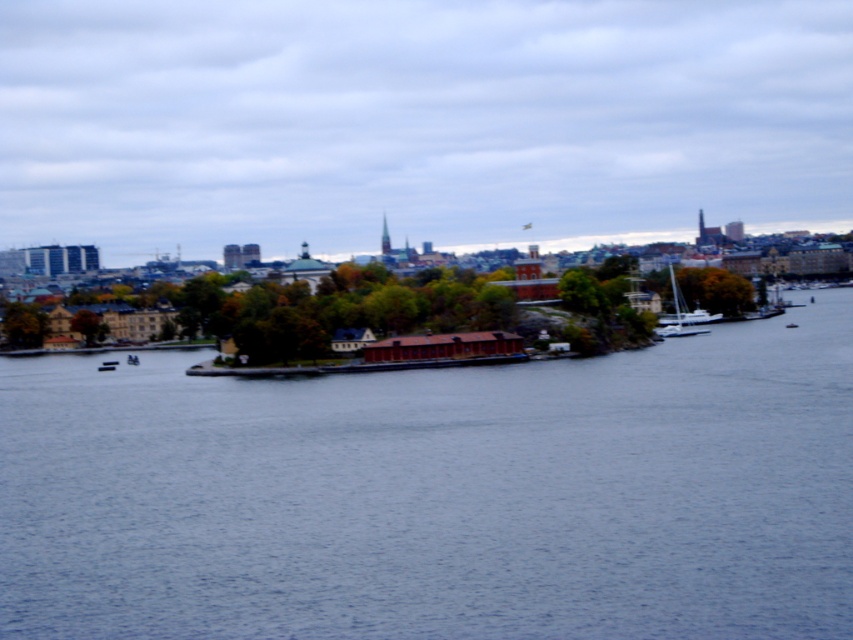
Question: Does blue water at center appear on the right side of green matte tree at center-left?

Choices:
 (A) yes
 (B) no

Answer: (A)

Question: Which object appears closest to the camera in this image?

Choices:
 (A) green matte tree at center-left
 (B) blue water at center
 (C) green matte tree at left

Answer: (B)

Question: Which point is closer to the camera?

Choices:
 (A) (96, 324)
 (B) (38, 346)
 (C) (672, 278)

Answer: (B)

Question: Which of the following is the farthest from the observer?

Choices:
 (A) (74, 316)
 (B) (503, 429)

Answer: (A)

Question: Is blue water at center positioned at the back of green matte tree at center-left?

Choices:
 (A) no
 (B) yes

Answer: (A)

Question: Does blue water at center lie in front of green matte tree at center-left?

Choices:
 (A) yes
 (B) no

Answer: (A)